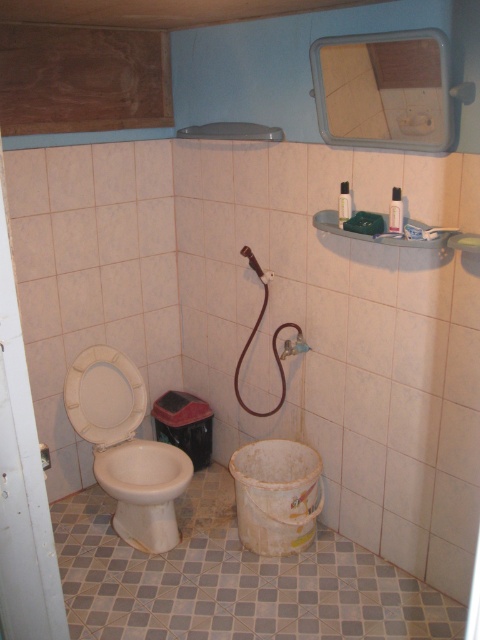
You are standing in the bathroom and need to place a small plant on the wall. There are two points marked on the wall where you can hang it. The first point is at coordinates point (144, 522) and the second is at point (261, 280). Which point is closer to you so the plant will be more visible?

Point (144, 522) is closer to the viewer than point (261, 280), so placing the plant there will make it more visible.

Consider the image. You are standing in a bathroom and want to reach a point that is 8.43 feet away from you. Can you confirm if the point at coordinates (178,540) is exactly at that distance?

The point at coordinates (178,540) is exactly 8.43 feet away from the camera, so yes, it is at the specified distance.